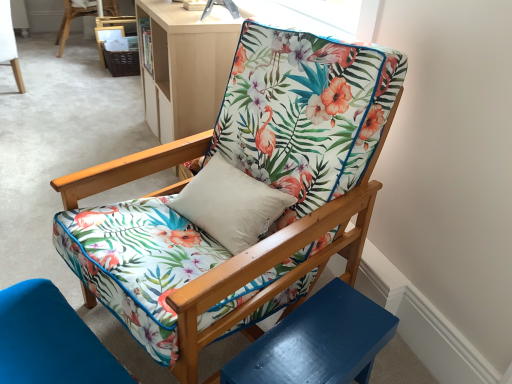
Question: Is floral fabric chair at upper center, the 3th chair from the front, outside floral fabric chair at center, the 1th chair in the right-to-left sequence?

Choices:
 (A) no
 (B) yes

Answer: (B)

Question: From the image's perspective, is floral fabric chair at upper center, which is the first chair in left-to-right order, beneath floral fabric chair at center, the 1th chair in the right-to-left sequence?

Choices:
 (A) no
 (B) yes

Answer: (A)

Question: From a real-world perspective, is floral fabric chair at upper center, which is the first chair in left-to-right order, on floral fabric chair at center, which appears as the 3th chair when viewed from the top?

Choices:
 (A) yes
 (B) no

Answer: (B)

Question: Is floral fabric chair at upper center, arranged as the second chair when viewed from the top, bigger than floral fabric chair at center, the 1th chair in the right-to-left sequence?

Choices:
 (A) yes
 (B) no

Answer: (B)

Question: Does floral fabric chair at upper center, the 3th chair from the front, have a greater width compared to floral fabric chair at center, the 1th chair in the right-to-left sequence?

Choices:
 (A) no
 (B) yes

Answer: (A)

Question: In terms of size, does floral fabric cushion at lower left, the second chair when ordered from front to back, appear bigger or smaller than floral fabric chair at center, the 1th chair in the right-to-left sequence?

Choices:
 (A) big
 (B) small

Answer: (B)

Question: Which is correct: floral fabric cushion at lower left, which is the 2th chair in right-to-left order, is inside floral fabric chair at center, the 4th chair viewed from the back, or outside of it?

Choices:
 (A) inside
 (B) outside

Answer: (B)

Question: In the image, is floral fabric cushion at lower left, which is the 3th chair from back to front, positioned in front of or behind floral fabric chair at center, the 4th chair viewed from the back?

Choices:
 (A) front
 (B) behind

Answer: (B)

Question: Visually, is floral fabric cushion at lower left, the first chair in the bottom-to-top sequence, positioned to the left or to the right of floral fabric chair at center, the 4th chair viewed from the back?

Choices:
 (A) left
 (B) right

Answer: (A)

Question: In terms of size, does glossy blue side table at lower right appear bigger or smaller than matte wood bookshelf at upper center?

Choices:
 (A) big
 (B) small

Answer: (B)

Question: Looking at their shapes, would you say glossy blue side table at lower right is wider or thinner than matte wood bookshelf at upper center?

Choices:
 (A) thin
 (B) wide

Answer: (B)

Question: Is glossy blue side table at lower right inside or outside of matte wood bookshelf at upper center?

Choices:
 (A) inside
 (B) outside

Answer: (B)

Question: From the image's perspective, relative to matte wood bookshelf at upper center, is glossy blue side table at lower right above or below?

Choices:
 (A) below
 (B) above

Answer: (A)

Question: Is glossy blue side table at lower right inside the boundaries of floral fabric chair at upper center, which is the 2th chair in back-to-front order, or outside?

Choices:
 (A) outside
 (B) inside

Answer: (A)

Question: In the image, is glossy blue side table at lower right positioned in front of or behind floral fabric chair at upper center, which appears as the 3th chair when ordered from the bottom?

Choices:
 (A) behind
 (B) front

Answer: (B)